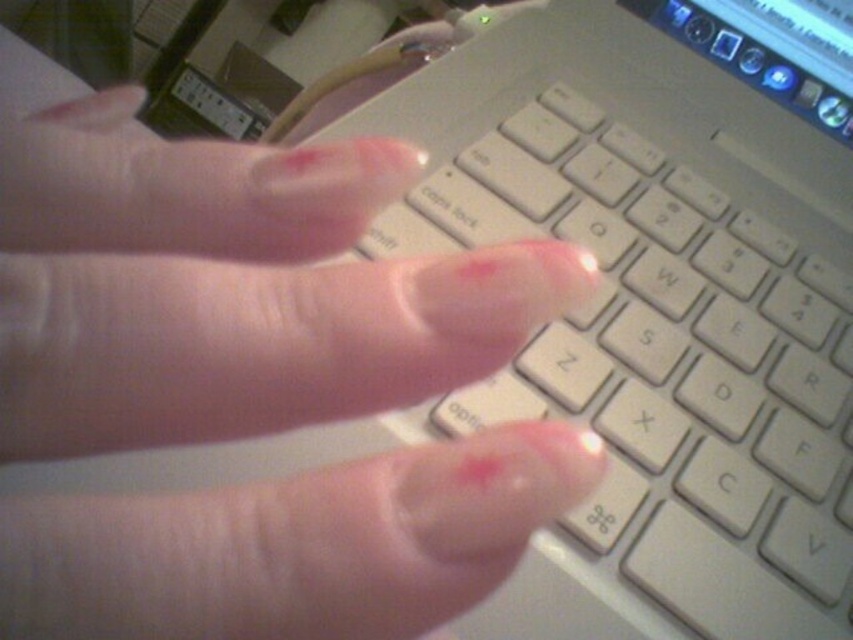
You are a photographer who wants to capture a detailed closeup of the white plastic keyboard at center and the clear skin at center in the scene. Since you can only focus on one object clearly, which object should you choose to ensure the other remains somewhat in focus due to its size?

The white plastic keyboard at center has a larger size compared to clear skin at center. Therefore, focusing on the white plastic keyboard at center would keep the clear skin at center somewhat in focus because it is smaller and closer to the background or foreground.

You are holding a 12 inch ruler and want to measure the distance between your eyes and the point at coordinates point (729, 432) in the image. Based on the scene description, can you determine if the ruler will be long enough to measure this distance?

The point at coordinates point (729, 432) is 13.51 inches away from the viewer. Since the ruler is only 12 inches long, it will not be long enough to measure the distance between your eyes and the point at coordinates point (729, 432).